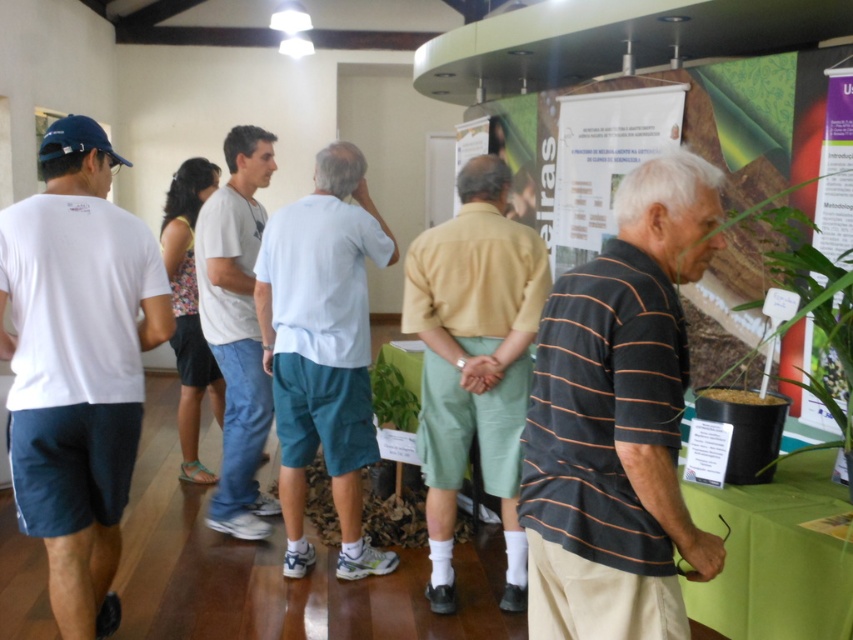
Question: Which object is positioned closest to the green leafy plant at center?

Choices:
 (A) light yellow shirt at center
 (B) white cotton shirt at center
 (C) green matte poster at upper right
 (D) white paper at upper center

Answer: (B)

Question: Where is light gray cotton t-shirt at center located in relation to green leafy plant at center in the image?

Choices:
 (A) left
 (B) right

Answer: (A)

Question: Does black striped shirt at right have a smaller size compared to light yellow shirt at center?

Choices:
 (A) no
 (B) yes

Answer: (B)

Question: Does light gray cotton t-shirt at center have a smaller size compared to green matte poster at upper right?

Choices:
 (A) no
 (B) yes

Answer: (A)

Question: Which of these objects is positioned farthest from the black striped shirt at right?

Choices:
 (A) light yellow shirt at center
 (B) green matte poster at upper right
 (C) light gray cotton t-shirt at center
 (D) green leafy plant at center

Answer: (D)

Question: Which point is farther to the camera?

Choices:
 (A) light yellow shirt at center
 (B) white cotton shirt at center
 (C) black striped shirt at right

Answer: (B)